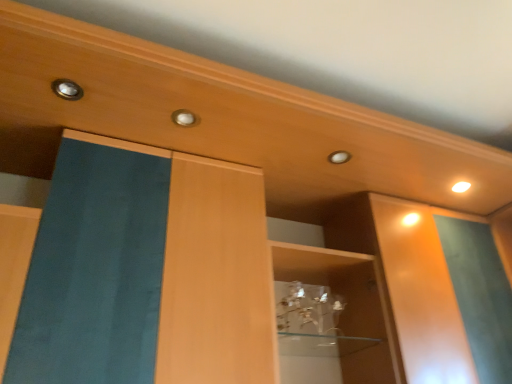
In order to click on matte gold knob at center, which is the first knob in back-to-front order in this screenshot , I will do `click(184, 118)`.

Does white glossy light at upper right appear on the left side of matte gold knob at center, which ranks as the first knob in bottom-to-top order?

Incorrect, white glossy light at upper right is not on the left side of matte gold knob at center, which ranks as the first knob in bottom-to-top order.

Is white glossy light at upper right oriented towards matte gold knob at center, which is counted as the second knob, starting from the left?

No, white glossy light at upper right is not aimed at matte gold knob at center, which is counted as the second knob, starting from the left.

You are a GUI agent. You are given a task and a screenshot of the screen. Output one action in this format:
    pyautogui.click(x=<x>, y=<y>)
    Task: Click on the lighting behind the matte gold knob at center, which is the first knob in right-to-left order
    
    Given the screenshot: What is the action you would take?
    pyautogui.click(x=461, y=187)

In the scene shown: Is white glossy light at upper right not within matte gold knob at center, which is counted as the second knob, starting from the left?

white glossy light at upper right lies outside matte gold knob at center, which is counted as the second knob, starting from the left,'s area.

Based on their sizes in the image, would you say matte metallic knob at upper left, the second knob when ordered from right to left, is bigger or smaller than matte gold knob at center, which appears as the 2th knob when viewed from the front?

Considering their sizes, matte metallic knob at upper left, the second knob when ordered from right to left, takes up more space than matte gold knob at center, which appears as the 2th knob when viewed from the front.

Which point is more distant from viewer, (56, 87) or (193, 117)?

The point (193, 117) is farther from the camera.

Is matte metallic knob at upper left, the second knob when ordered from right to left, not near matte gold knob at center, which is the first knob in right-to-left order?

That's not correct — matte metallic knob at upper left, the second knob when ordered from right to left, is a little close to matte gold knob at center, which is the first knob in right-to-left order.

Locate an element on the screen. This screenshot has height=384, width=512. knob in front of the matte gold knob at center, which is counted as the second knob, starting from the left is located at coordinates (67, 89).

Considering the relative sizes of matte gold knob at center, which is counted as the second knob, starting from the left, and matte metallic knob at upper left, the second knob when ordered from right to left, in the image provided, is matte gold knob at center, which is counted as the second knob, starting from the left, taller than matte metallic knob at upper left, the second knob when ordered from right to left,?

No.

Which is behind, matte gold knob at center, which appears as the 2th knob when viewed from the front, or matte metallic knob at upper left, positioned as the 2th knob in back-to-front order?

Positioned behind is matte gold knob at center, which appears as the 2th knob when viewed from the front.

Is matte gold knob at center, which is the first knob in back-to-front order, facing towards matte metallic knob at upper left, the 1th knob positioned from the top?

No, matte gold knob at center, which is the first knob in back-to-front order, is not facing towards matte metallic knob at upper left, the 1th knob positioned from the top.

Does matte gold knob at center, which is the first knob in right-to-left order, have a smaller size compared to matte metallic knob at upper left, marked as the 2th knob in a bottom-to-top arrangement?

Indeed, matte gold knob at center, which is the first knob in right-to-left order, has a smaller size compared to matte metallic knob at upper left, marked as the 2th knob in a bottom-to-top arrangement.

Is matte gold knob at center, which is counted as the second knob, starting from the left, positioned far away from white glossy light at upper right?

They are positioned close to each other.

Would you say matte gold knob at center, which appears as the 2th knob when viewed from the front, is inside or outside white glossy light at upper right?

matte gold knob at center, which appears as the 2th knob when viewed from the front, is not enclosed by white glossy light at upper right.

From the image's perspective, would you say matte gold knob at center, which ranks as the first knob in bottom-to-top order, is shown under white glossy light at upper right?

No.

Considering the relative sizes of matte gold knob at center, which appears as the 2th knob when viewed from the front, and white glossy light at upper right in the image provided, is matte gold knob at center, which appears as the 2th knob when viewed from the front, taller than white glossy light at upper right?

Incorrect, the height of matte gold knob at center, which appears as the 2th knob when viewed from the front, is not larger of that of white glossy light at upper right.

From the image's perspective, is white glossy light at upper right on top of matte metallic knob at upper left, marked as the 2th knob in a bottom-to-top arrangement?

No, from the image's perspective, white glossy light at upper right is not on top of matte metallic knob at upper left, marked as the 2th knob in a bottom-to-top arrangement.

Can you confirm if white glossy light at upper right is shorter than matte metallic knob at upper left, which is the first knob in front-to-back order?

In fact, white glossy light at upper right may be taller than matte metallic knob at upper left, which is the first knob in front-to-back order.

Considering their positions, is white glossy light at upper right located in front of or behind matte metallic knob at upper left, the 1th knob positioned from the top?

white glossy light at upper right is behind matte metallic knob at upper left, the 1th knob positioned from the top.

Which object is more forward, matte metallic knob at upper left, the second knob when ordered from right to left, or white glossy light at upper right?

matte metallic knob at upper left, the second knob when ordered from right to left, is more forward.

Could you tell me if matte metallic knob at upper left, the 1th knob positioned from the top, is facing white glossy light at upper right?

No, matte metallic knob at upper left, the 1th knob positioned from the top, does not turn towards white glossy light at upper right.

In terms of width, does matte metallic knob at upper left, the 1th knob positioned from the top, look wider or thinner when compared to white glossy light at upper right?

Clearly, matte metallic knob at upper left, the 1th knob positioned from the top, has more width compared to white glossy light at upper right.

Considering the relative sizes of matte metallic knob at upper left, the second knob when ordered from right to left, and white glossy light at upper right in the image provided, is matte metallic knob at upper left, the second knob when ordered from right to left, shorter than white glossy light at upper right?

Yes, matte metallic knob at upper left, the second knob when ordered from right to left, is shorter than white glossy light at upper right.

Find the location of a particular element. The image size is (512, 384). lighting that is under the matte gold knob at center, which is counted as the second knob, starting from the left (from a real-world perspective) is located at coordinates (461, 187).

Where is `knob lying in front of the matte gold knob at center, which is the second knob in top-to-bottom order`? knob lying in front of the matte gold knob at center, which is the second knob in top-to-bottom order is located at coordinates (x=67, y=89).

Considering their positions, is matte gold knob at center, which ranks as the first knob in bottom-to-top order, positioned further to matte metallic knob at upper left, the 1th knob positioned from the top, than white glossy light at upper right?

white glossy light at upper right.

Considering their positions, is white glossy light at upper right positioned further to matte metallic knob at upper left, which is the first knob in front-to-back order, than matte gold knob at center, which is the first knob in right-to-left order?

white glossy light at upper right is positioned further to the anchor matte metallic knob at upper left, which is the first knob in front-to-back order.

Looking at the image, which one is located closer to matte gold knob at center, which is the first knob in right-to-left order, matte metallic knob at upper left, the 1th knob positioned from the top, or white glossy light at upper right?

matte metallic knob at upper left, the 1th knob positioned from the top, is positioned closer to the anchor matte gold knob at center, which is the first knob in right-to-left order.

From the image, which object appears to be farther from white glossy light at upper right, matte metallic knob at upper left, which is the first knob in front-to-back order, or matte gold knob at center, which ranks as the first knob in bottom-to-top order?

matte metallic knob at upper left, which is the first knob in front-to-back order, is positioned further to the anchor white glossy light at upper right.

Estimate the real-world distances between objects in this image. Which object is closer to white glossy light at upper right, matte gold knob at center, which is the first knob in back-to-front order, or matte metallic knob at upper left, which ranks as the first knob in left-to-right order?

Based on the image, matte gold knob at center, which is the first knob in back-to-front order, appears to be nearer to white glossy light at upper right.

When comparing their distances from matte gold knob at center, which is the first knob in right-to-left order, does white glossy light at upper right or matte metallic knob at upper left, positioned as the 2th knob in back-to-front order, seem further?

The object further to matte gold knob at center, which is the first knob in right-to-left order, is white glossy light at upper right.

The width and height of the screenshot is (512, 384). In order to click on knob situated between matte metallic knob at upper left, which ranks as the first knob in left-to-right order, and white glossy light at upper right from left to right in this screenshot , I will do [x=184, y=118].